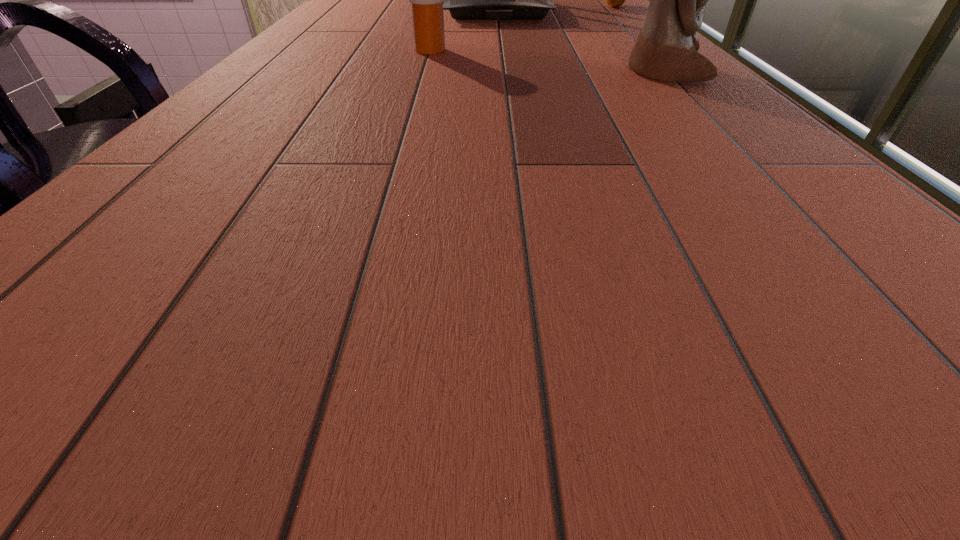
At what (x,y) coordinates should I click in order to perform the action: click on vacant space on the desktop that is between the second nearest object and the nearest object and is positioned with leaves positioned above the lemon. Please return your answer as a coordinate pair (x, y). The height and width of the screenshot is (540, 960). Looking at the image, I should click on (561, 63).

The image size is (960, 540). Find the location of `free space on the desktop that is between the second shortest object and the nearest object and is positioned on the front-facing side of the second tallest object`. free space on the desktop that is between the second shortest object and the nearest object and is positioned on the front-facing side of the second tallest object is located at coordinates (506, 58).